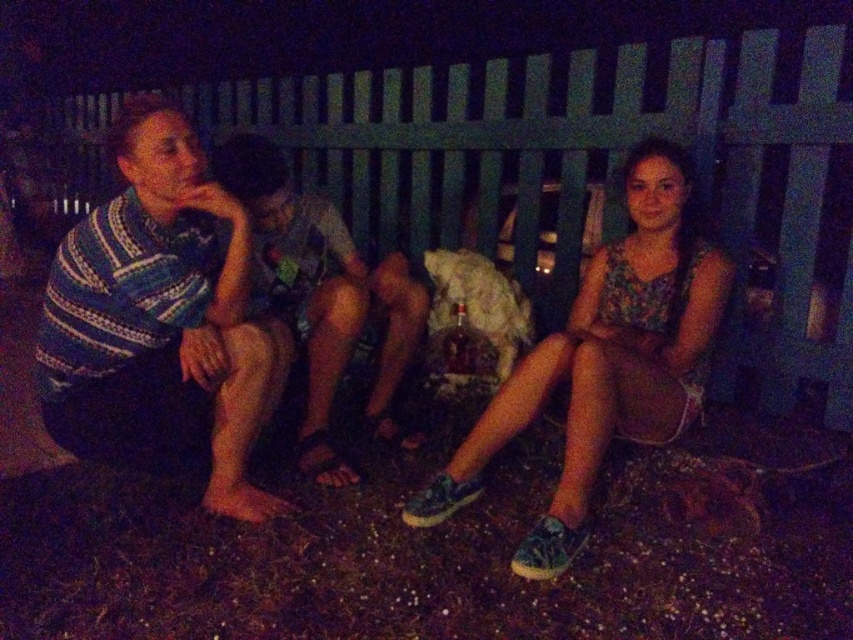
Does point (762, 192) come behind point (445, 472)?

Yes.

Between green wooden fence at upper center and floral fabric dress at center, which one has less height?

Standing shorter between the two is floral fabric dress at center.

Locate an element on the screen. This screenshot has height=640, width=853. green wooden fence at upper center is located at coordinates (599, 176).

At what (x,y) coordinates should I click in order to perform the action: click on green wooden fence at upper center. Please return your answer as a coordinate pair (x, y). Looking at the image, I should click on (599, 176).

Which is below, striped knit shirt at left or striped knit shirt at center?

striped knit shirt at left is below.

Does striped knit shirt at left have a greater height compared to striped knit shirt at center?

Correct, striped knit shirt at left is much taller as striped knit shirt at center.

At what (x,y) coordinates should I click in order to perform the action: click on striped knit shirt at left. Please return your answer as a coordinate pair (x, y). The height and width of the screenshot is (640, 853). Looking at the image, I should click on (161, 321).

The width and height of the screenshot is (853, 640). What are the coordinates of `striped knit shirt at left` in the screenshot? It's located at (161, 321).

Is green wooden fence at upper center further to the viewer compared to striped knit shirt at center?

No, it is in front of striped knit shirt at center.

Can you confirm if green wooden fence at upper center is positioned to the right of striped knit shirt at center?

Correct, you'll find green wooden fence at upper center to the right of striped knit shirt at center.

At what (x,y) coordinates should I click in order to perform the action: click on green wooden fence at upper center. Please return your answer as a coordinate pair (x, y). The width and height of the screenshot is (853, 640). Looking at the image, I should click on (599, 176).

Find the location of `green wooden fence at upper center`. green wooden fence at upper center is located at coordinates (599, 176).